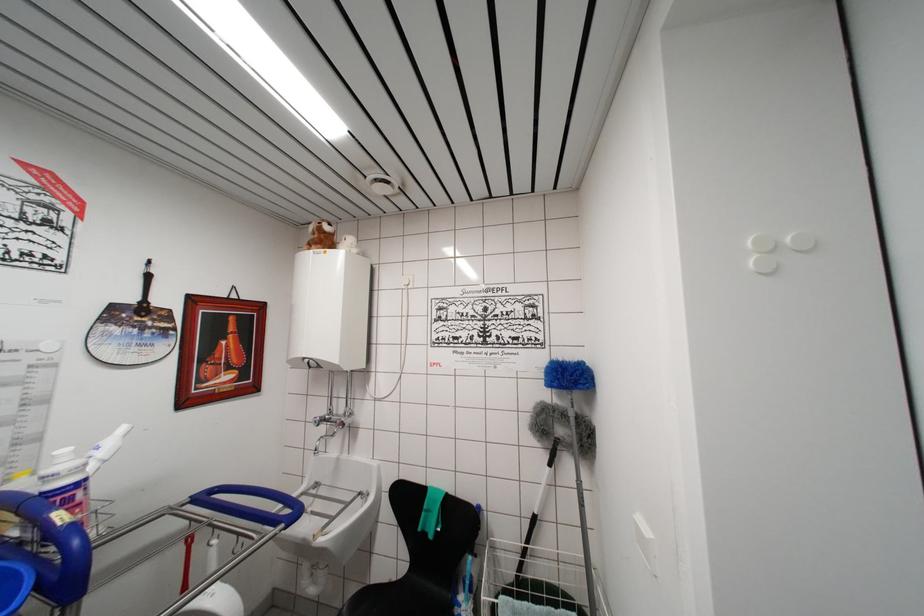
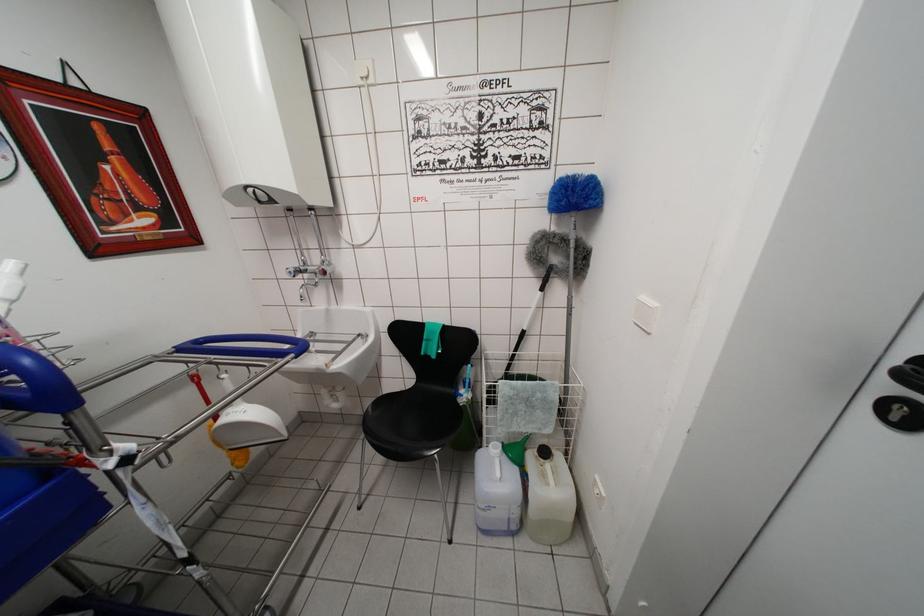
Question: Based on the continuous images, in which direction is the camera rotating? Reply with the corresponding letter.

Choices:
 (A) Left
 (B) Right
 (C) Up
 (D) Down

Answer: (D)